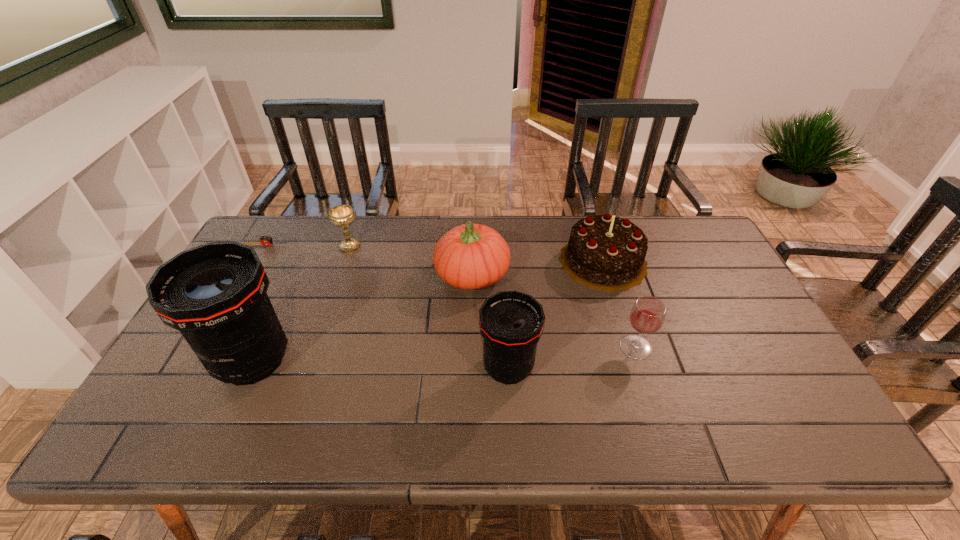
What are the coordinates of `vacant area that satisfies the following two spatial constraints: 1. on the back side of the birthday cake; 2. on the left side of the taller telephoto lens` in the screenshot? It's located at (299, 261).

This screenshot has width=960, height=540. I want to click on vacant region that satisfies the following two spatial constraints: 1. on the back side of the taller telephoto lens; 2. on the right side of the wineglass, so click(x=259, y=347).

In order to click on vacant region that satisfies the following two spatial constraints: 1. on the back side of the birthday cake; 2. on the right side of the taller telephoto lens in this screenshot , I will do `click(299, 261)`.

Locate an element on the screen. This screenshot has height=540, width=960. free spot that satisfies the following two spatial constraints: 1. on the front side of the shorter telephoto lens; 2. on the left side of the left telephoto lens is located at coordinates (250, 368).